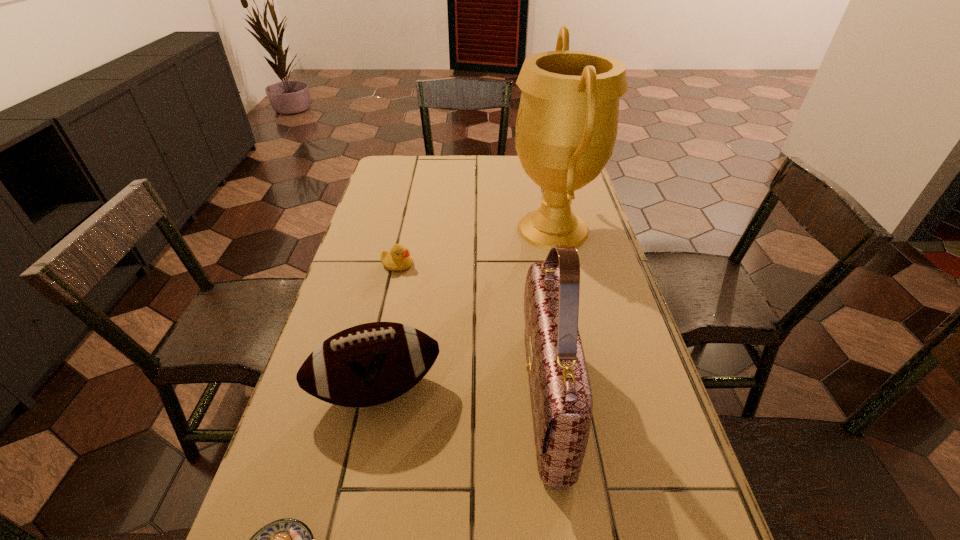
Image resolution: width=960 pixels, height=540 pixels. Find the location of `the tallest object`. the tallest object is located at coordinates (567, 122).

Find the location of a particular element. The width and height of the screenshot is (960, 540). handbag is located at coordinates (561, 398).

Identify the location of the third tallest object. (369, 364).

The width and height of the screenshot is (960, 540). In order to click on the fourth tallest object in this screenshot , I will do `click(398, 258)`.

Find the location of a particular element. vacant space located on the engravings side of the tallest object is located at coordinates (451, 230).

Where is `vacant area situated on the engravings side of the tallest object`? vacant area situated on the engravings side of the tallest object is located at coordinates (448, 230).

Image resolution: width=960 pixels, height=540 pixels. I want to click on vacant region located 0.050m on the engravings side of the tallest object, so click(492, 230).

The width and height of the screenshot is (960, 540). I want to click on free spot located 0.180m on the front of the handbag with the clasp, so click(437, 399).

Locate an element on the screen. Image resolution: width=960 pixels, height=540 pixels. free spot located on the front of the handbag with the clasp is located at coordinates (485, 399).

This screenshot has height=540, width=960. Identify the location of vacant space located on the front of the handbag with the clasp. (379, 399).